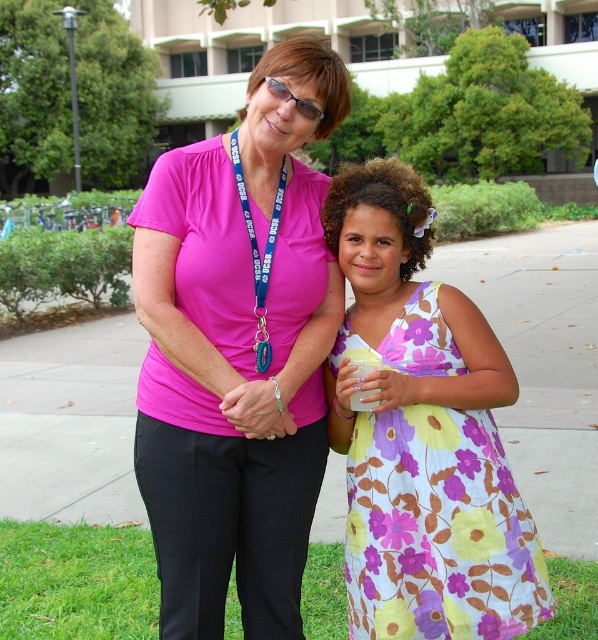
Does paved concrete sidewalk at center appear on the left side of floral cotton dress at center?

In fact, paved concrete sidewalk at center is to the right of floral cotton dress at center.

At what (x,y) coordinates should I click in order to perform the action: click on paved concrete sidewalk at center. Please return your answer as a coordinate pair (x, y). Looking at the image, I should click on (544, 365).

From the picture: Measure the distance between paved concrete sidewalk at center and camera.

A distance of 2.23 meters exists between paved concrete sidewalk at center and camera.

The image size is (598, 640). Identify the location of paved concrete sidewalk at center. (544, 365).

Which is more to the left, pink fabric shirt at center or floral cotton dress at center?

pink fabric shirt at center

Which is in front, point (178, 248) or point (413, 529)?

Point (413, 529) is more forward.

Locate an element on the screen. The image size is (598, 640). pink fabric shirt at center is located at coordinates click(x=237, y=352).

Does pink fabric shirt at center have a greater width compared to paved concrete sidewalk at center?

No, pink fabric shirt at center is not wider than paved concrete sidewalk at center.

Who is shorter, pink fabric shirt at center or paved concrete sidewalk at center?

With less height is pink fabric shirt at center.

Does point (264, 310) lie in front of point (447, 250)?

Yes, it is in front of point (447, 250).

Identify the location of pink fabric shirt at center. This screenshot has width=598, height=640. (237, 352).